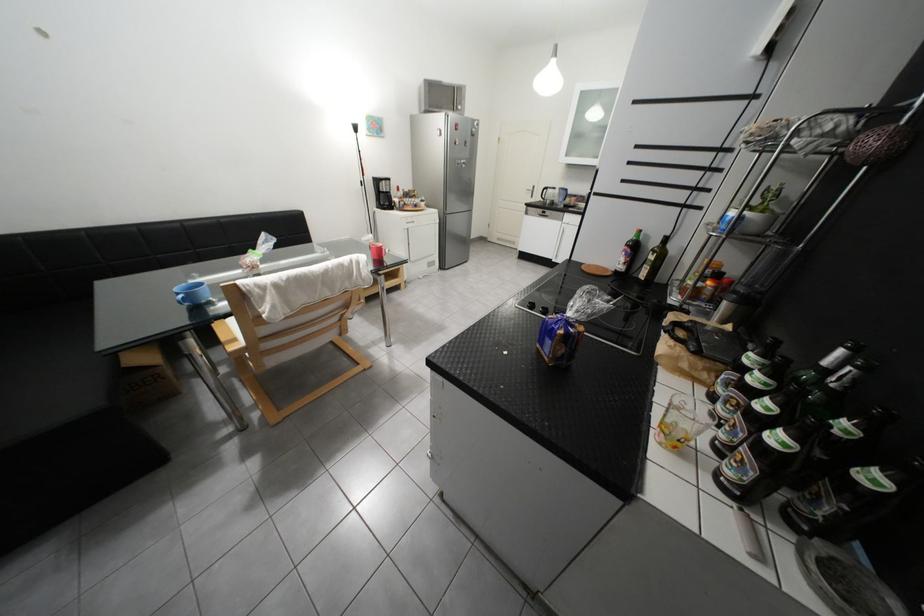
Find where to resting arm the wooden chair armrest. Please return your answer as a coordinate pair (x, y).

(228, 334)